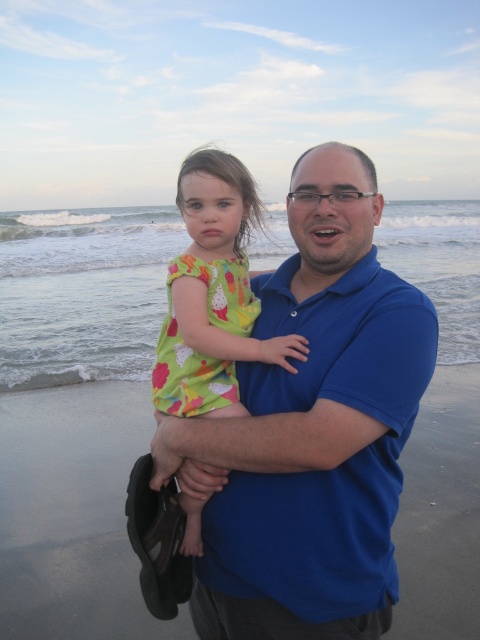
Question: Based on their relative distances, which object is nearer to the blue cotton shirt at center?

Choices:
 (A) smooth sand at center
 (B) printed cotton dress at center

Answer: (B)

Question: Is blue cotton shirt at center smaller than smooth sand at center?

Choices:
 (A) yes
 (B) no

Answer: (B)

Question: Is blue cotton shirt at center below printed cotton dress at center?

Choices:
 (A) yes
 (B) no

Answer: (A)

Question: Considering the relative positions of smooth sand at center and printed cotton dress at center in the image provided, where is smooth sand at center located with respect to printed cotton dress at center?

Choices:
 (A) below
 (B) above

Answer: (A)

Question: Which point is farther from the camera taking this photo?

Choices:
 (A) (79, 573)
 (B) (210, 208)
 (C) (288, 627)

Answer: (A)

Question: Which object is closer to the camera taking this photo?

Choices:
 (A) blue cotton shirt at center
 (B) printed cotton dress at center
 (C) smooth sand at center

Answer: (A)